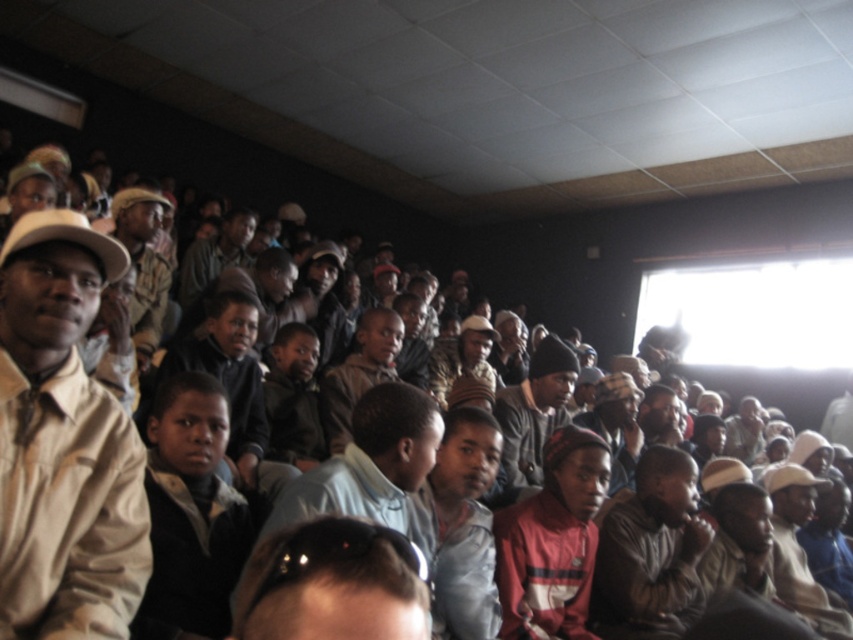
Question: Which object is the closest to the black fabric jacket at center?

Choices:
 (A) red knit cap at center
 (B) light brown leather jacket at center
 (C) beige fabric shirt at left
 (D) shiny black sunglasses at center

Answer: (C)

Question: Estimate the real-world distances between objects in this image. Which object is closer to the black fabric jacket at center?

Choices:
 (A) shiny black sunglasses at center
 (B) light brown leather jacket at center

Answer: (A)

Question: Is shiny black sunglasses at center further to the viewer compared to dark gray jacket at center?

Choices:
 (A) no
 (B) yes

Answer: (A)

Question: Observing the image, what is the correct spatial positioning of shiny black sunglasses at center in reference to light brown leather jacket at center?

Choices:
 (A) left
 (B) right

Answer: (B)

Question: Which object is positioned closest to the beige fabric shirt at left?

Choices:
 (A) dark gray knit cap at center
 (B) dark gray jacket at center

Answer: (A)

Question: Does beige fabric shirt at left have a smaller size compared to dark gray jacket at center?

Choices:
 (A) no
 (B) yes

Answer: (B)